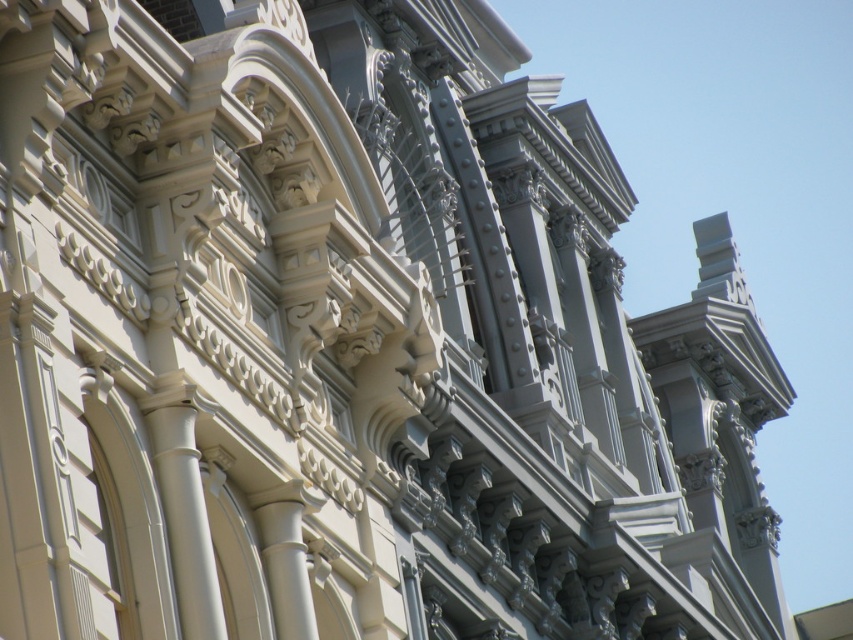
Between white smooth column at left and white glossy column at center, which one is positioned lower?

Positioned lower is white glossy column at center.

Is white smooth column at left bigger than white glossy column at center?

Correct, white smooth column at left is larger in size than white glossy column at center.

Identify the location of white smooth column at left. (186, 522).